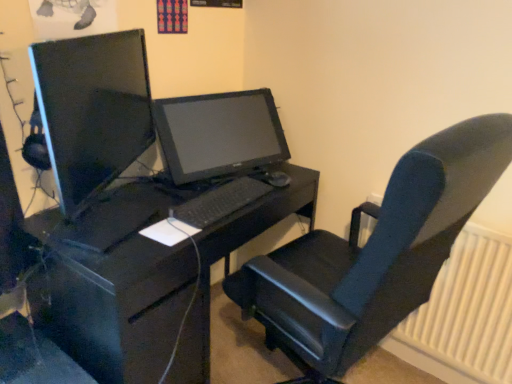
The image size is (512, 384). I want to click on free point above black matte keyboard at center (from a real-world perspective), so click(219, 188).